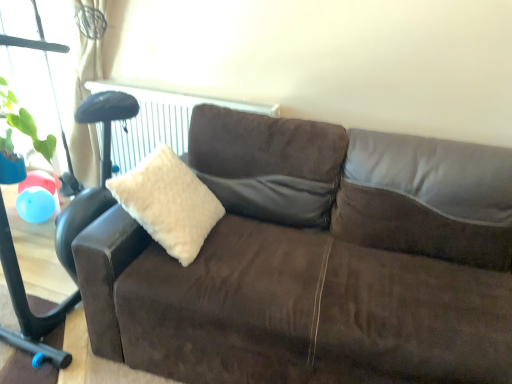
Question: Considering the relative sizes of white fluffy pillow at center and brown suede couch at center in the image provided, is white fluffy pillow at center bigger than brown suede couch at center?

Choices:
 (A) yes
 (B) no

Answer: (B)

Question: Is white fluffy pillow at center positioned in front of brown suede couch at center?

Choices:
 (A) no
 (B) yes

Answer: (A)

Question: From the image's perspective, is white fluffy pillow at center located beneath brown suede couch at center?

Choices:
 (A) yes
 (B) no

Answer: (B)

Question: Is white fluffy pillow at center to the left of brown suede couch at center from the viewer's perspective?

Choices:
 (A) no
 (B) yes

Answer: (B)

Question: From the image's perspective, is white fluffy pillow at center on brown suede couch at center?

Choices:
 (A) no
 (B) yes

Answer: (B)

Question: Is brown suede couch at center completely or partially inside white fluffy pillow at center?

Choices:
 (A) yes
 (B) no

Answer: (B)

Question: Is brown suede couch at center taller than white fluffy pillow at center?

Choices:
 (A) yes
 (B) no

Answer: (A)

Question: Is brown suede couch at center next to white fluffy pillow at center and touching it?

Choices:
 (A) no
 (B) yes

Answer: (A)

Question: From the image's perspective, is brown suede couch at center located above white fluffy pillow at center?

Choices:
 (A) no
 (B) yes

Answer: (A)

Question: Is brown suede couch at center bigger than white fluffy pillow at center?

Choices:
 (A) no
 (B) yes

Answer: (B)

Question: Is brown suede couch at center not close to white fluffy pillow at center?

Choices:
 (A) yes
 (B) no

Answer: (B)

Question: Is brown suede couch at center positioned in front of white fluffy pillow at center?

Choices:
 (A) yes
 (B) no

Answer: (A)

Question: From a real-world perspective, relative to white fluffy pillow at center, is brown suede couch at center vertically above or below?

Choices:
 (A) above
 (B) below

Answer: (B)